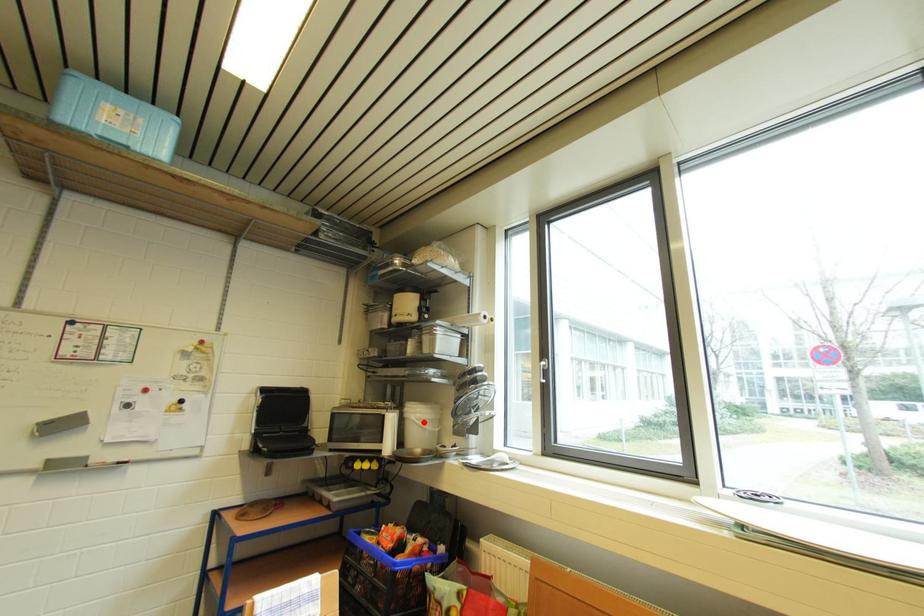
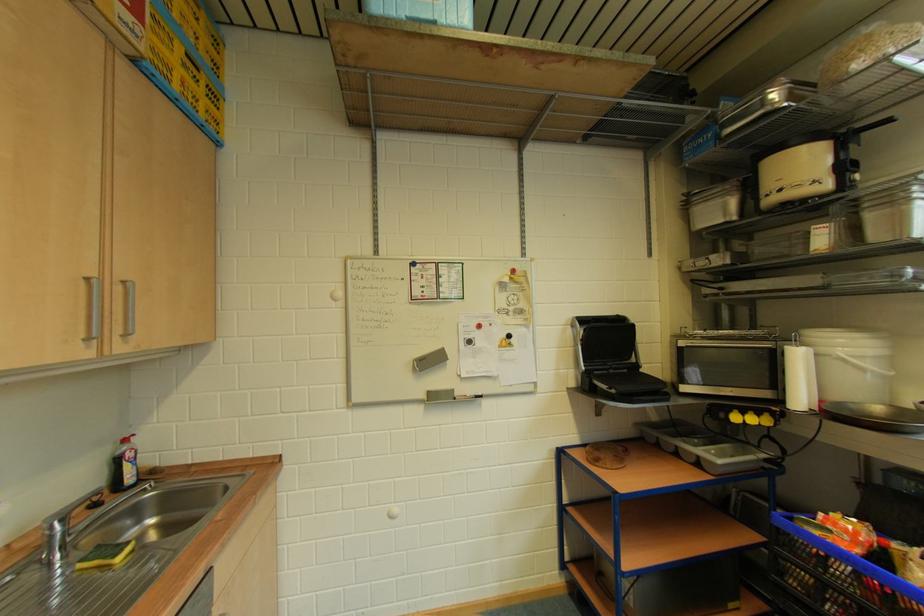
Locate, in the second image, the point that corresponds to the highlighted location in the first image.

(858, 360)